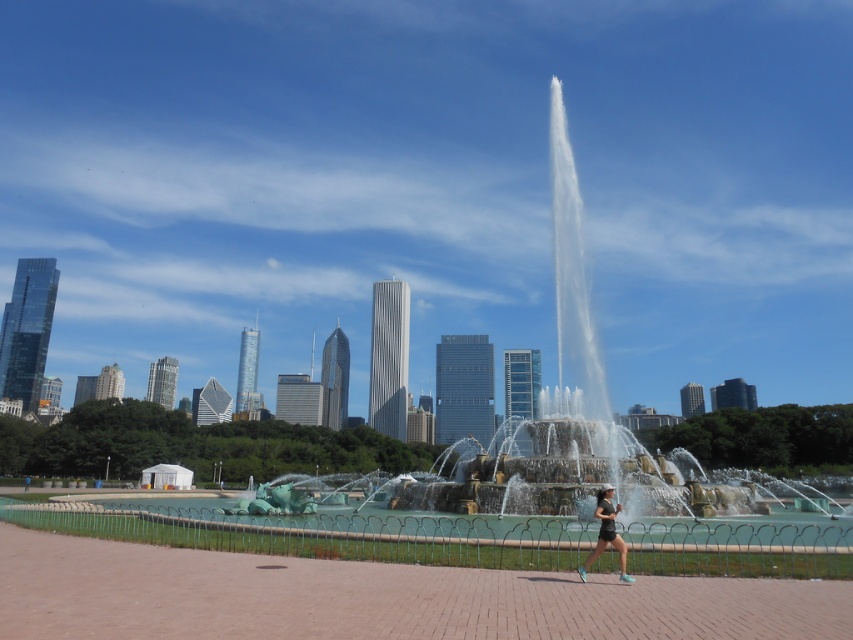
You are standing in the park and want to take a photo of the green patina fountain at center. If your camera can focus on objects up to 100 feet away, will you need to move closer to get a clear shot?

The green patina fountain at center is 103.58 feet away from you, which is beyond the camera focus range of 100 feet. Therefore, you need to move closer to ensure the fountain is within the 100 feet focus range for a clear photo.

You are standing in the park and want to take a photo of the green patina fountain at center and the matte black shorts at center. Which object should you focus on first to ensure both are in the same frame?

You should focus on the green patina fountain at center first because it is closer to you than the matte black shorts at center, allowing both to be in the same frame when properly adjusted.

You are standing in the park and want to take a photo of both the fountain and the city skyline. The fountain is at point (570, 372) and the city skyline is at point (583, 566). Since you want both in focus, will you need to adjust your camera settings if you focus on the fountain first?

Point (570, 372) is further to the camera than point (583, 566). If you focus on the fountain at point (570, 372), the city skyline at point (583, 566) will be closer to the camera and may not be in focus. Adjust your focus or use a smaller aperture to ensure both are sharp.